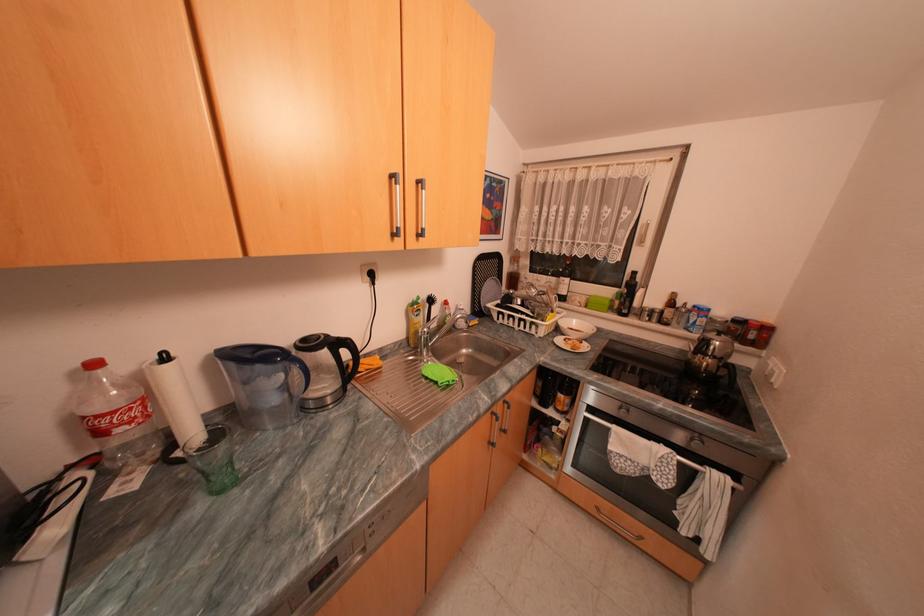
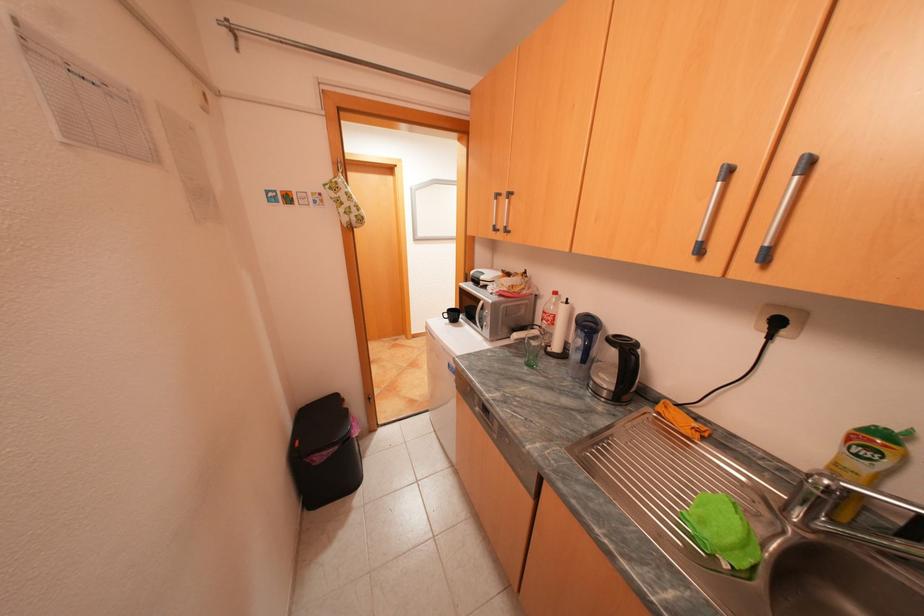
Find the pixel in the second image that matches (x=156, y=398) in the first image.

(565, 315)